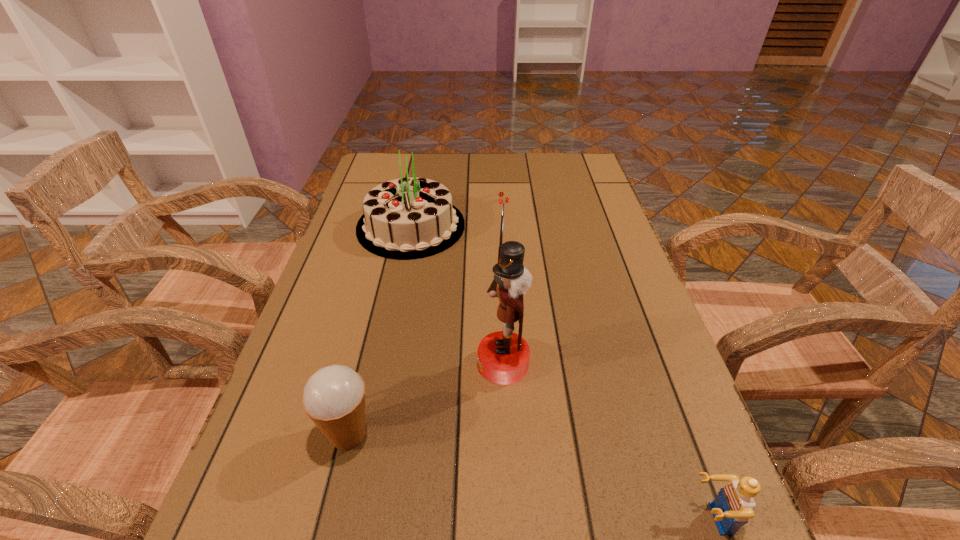
At what (x,y) coordinates should I click in order to perform the action: click on the second object from right to left. Please return your answer as a coordinate pair (x, y). The image size is (960, 540). Looking at the image, I should click on (503, 357).

Find the location of a particular element. This screenshot has height=540, width=960. the third nearest object is located at coordinates (503, 357).

Find the location of a particular element. This screenshot has width=960, height=540. birthday cake is located at coordinates (407, 218).

Image resolution: width=960 pixels, height=540 pixels. Find the location of `the third shortest object`. the third shortest object is located at coordinates (407, 218).

This screenshot has width=960, height=540. What are the coordinates of `the third tallest object` in the screenshot? It's located at (334, 397).

The image size is (960, 540). I want to click on the second nearest object, so click(x=334, y=397).

This screenshot has height=540, width=960. In order to click on blank space located on the front-facing side of the tallest object in this screenshot , I will do `click(316, 363)`.

Where is `vacant space located 0.240m on the front-facing side of the tallest object`? The height and width of the screenshot is (540, 960). vacant space located 0.240m on the front-facing side of the tallest object is located at coordinates (352, 363).

Locate an element on the screen. The height and width of the screenshot is (540, 960). free space located on the front-facing side of the tallest object is located at coordinates [425, 363].

The image size is (960, 540). What are the coordinates of `free location located on the back of the farthest object` in the screenshot? It's located at (424, 164).